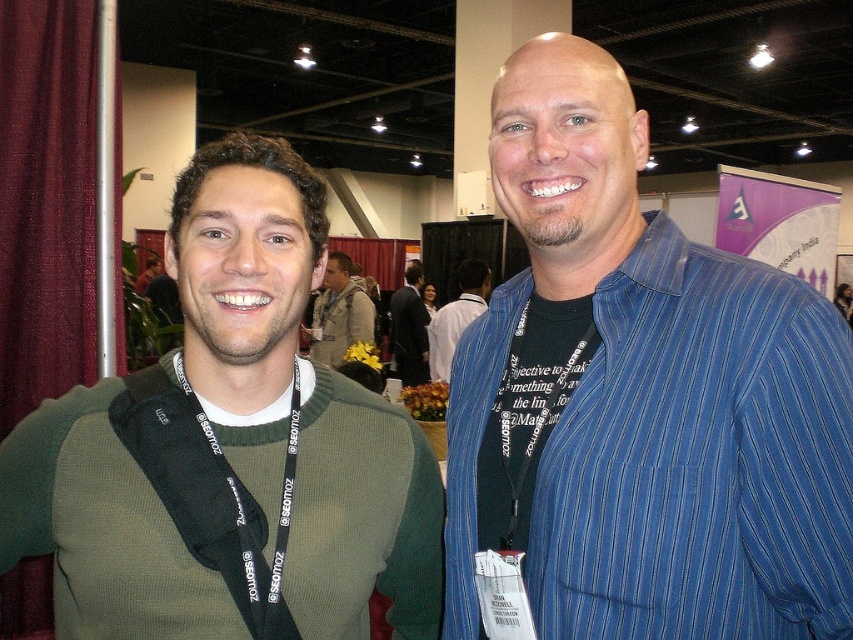
Question: Estimate the real-world distances between objects in this image. Which object is closer to the blue striped shirt at center?

Choices:
 (A) blue striped shirt at right
 (B) dark blue shirt at center

Answer: (A)

Question: Considering the relative positions of blue striped shirt at center and green knitted sweater at left in the image provided, where is blue striped shirt at center located with respect to green knitted sweater at left?

Choices:
 (A) left
 (B) right

Answer: (B)

Question: Does blue striped shirt at center have a smaller size compared to green knitted sweater at left?

Choices:
 (A) yes
 (B) no

Answer: (B)

Question: Which object is farther from the camera taking this photo?

Choices:
 (A) green knitted sweater at left
 (B) blue striped shirt at center
 (C) dark blue shirt at center
 (D) green sweater at center

Answer: (C)

Question: From the image, what is the correct spatial relationship of green sweater at center in relation to blue striped shirt at right?

Choices:
 (A) left
 (B) right

Answer: (A)

Question: Which point is closer to the camera?

Choices:
 (A) green knitted sweater at left
 (B) green sweater at center
 (C) blue striped shirt at right
 (D) dark blue shirt at center

Answer: (A)